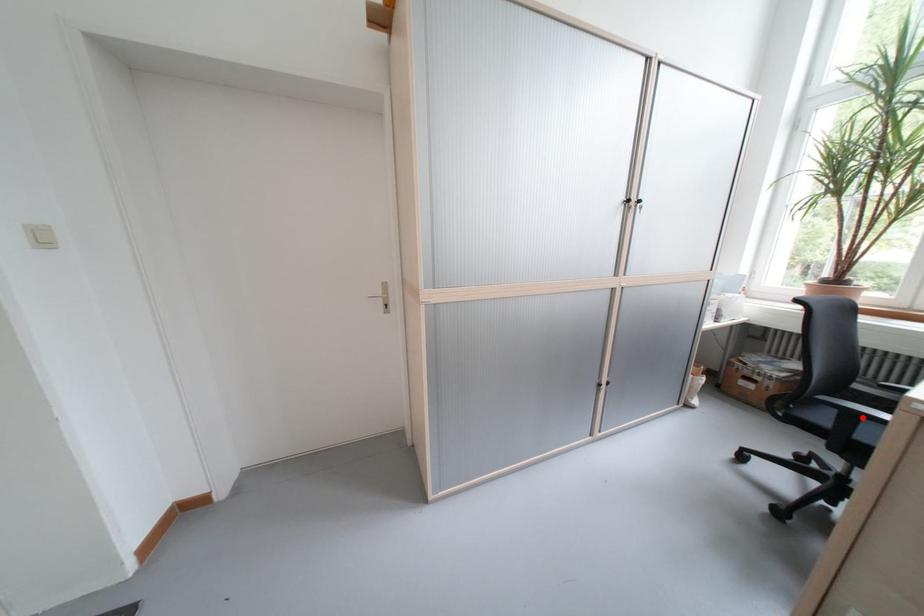
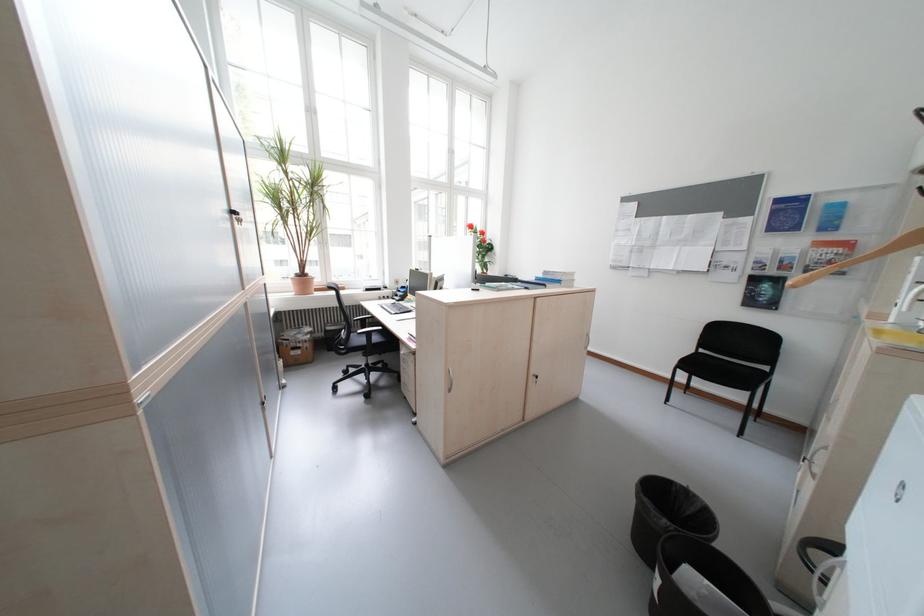
Question: I am providing you with two images of the same scene from different viewpoints. Image1 has a red point marked. In image2, the corresponding 3D location appears at what relative position? Reply with the corresponding letter.

Choices:
 (A) Closer
 (B) Farther

Answer: (A)